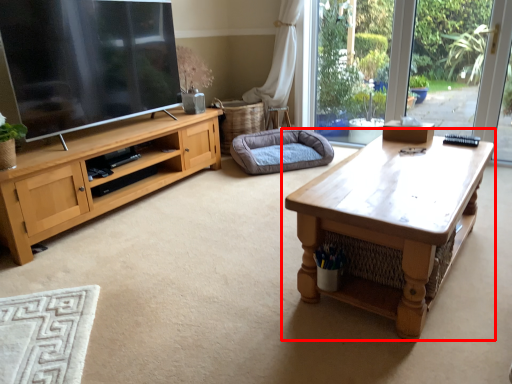
Question: Considering the relative positions of coffee table (annotated by the red box) and dog bed in the image provided, where is coffee table (annotated by the red box) located with respect to the staircase?

Choices:
 (A) left
 (B) right

Answer: (B)